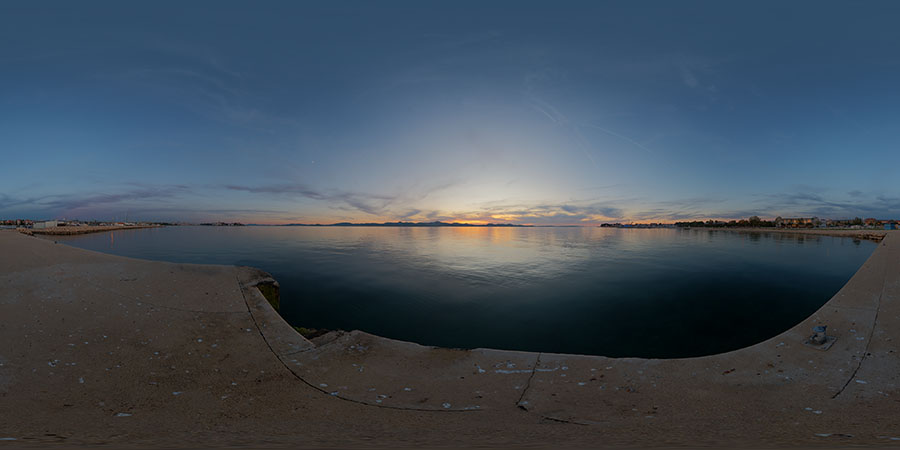
Locate an element on the screen. stairs is located at coordinates (315, 330).